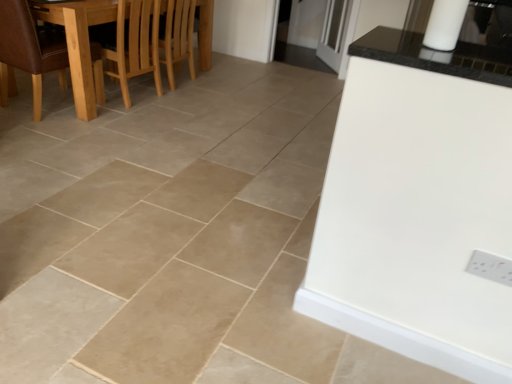
Locate an element on the screen. The width and height of the screenshot is (512, 384). free location to the right of wooden dining table at left is located at coordinates (254, 112).